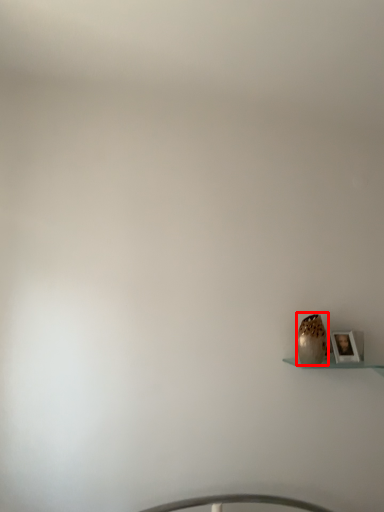
Question: From the image's perspective, where is vase (annotated by the red box) located in relation to picture frame in the image?

Choices:
 (A) above
 (B) below

Answer: (A)